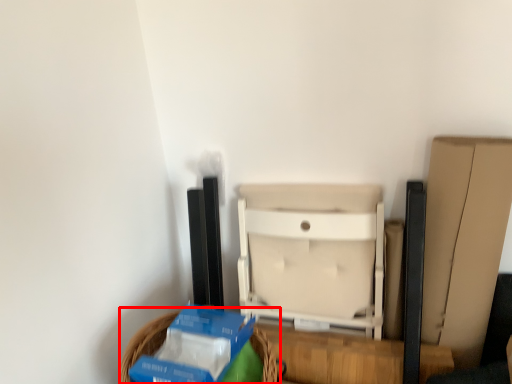
Question: From the image, what is the correct spatial relationship of basket (annotated by the red box) in relation to furniture?

Choices:
 (A) left
 (B) right

Answer: (A)